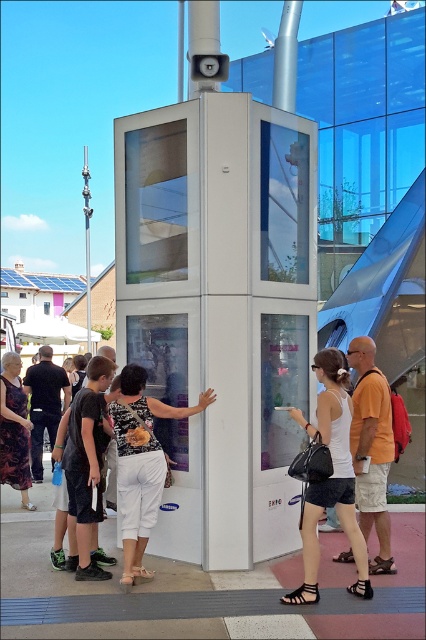
Between white glossy phone box at center and dark floral dress at center, which one appears on the left side from the viewer's perspective?

From the viewer's perspective, dark floral dress at center appears more on the left side.

Who is taller, white glossy phone box at center or dark floral dress at center?

white glossy phone box at center

Who is more distant from viewer, (224, 170) or (2, 481)?

The point (2, 481) is behind.

This screenshot has width=426, height=640. I want to click on white glossy phone box at center, so click(x=219, y=310).

Does white glossy phone box at center appear under printed fabric blouse at center?

Incorrect, white glossy phone box at center is not positioned below printed fabric blouse at center.

Measure the distance between white glossy phone box at center and camera.

A distance of 5.58 meters exists between white glossy phone box at center and camera.

The image size is (426, 640). What are the coordinates of `white glossy phone box at center` in the screenshot? It's located at (219, 310).

Does point (131, 477) come behind point (92, 545)?

That is False.

Is point (118, 486) in front of point (71, 515)?

That is True.

Where is `printed fabric blouse at center`? The width and height of the screenshot is (426, 640). printed fabric blouse at center is located at coordinates (141, 464).